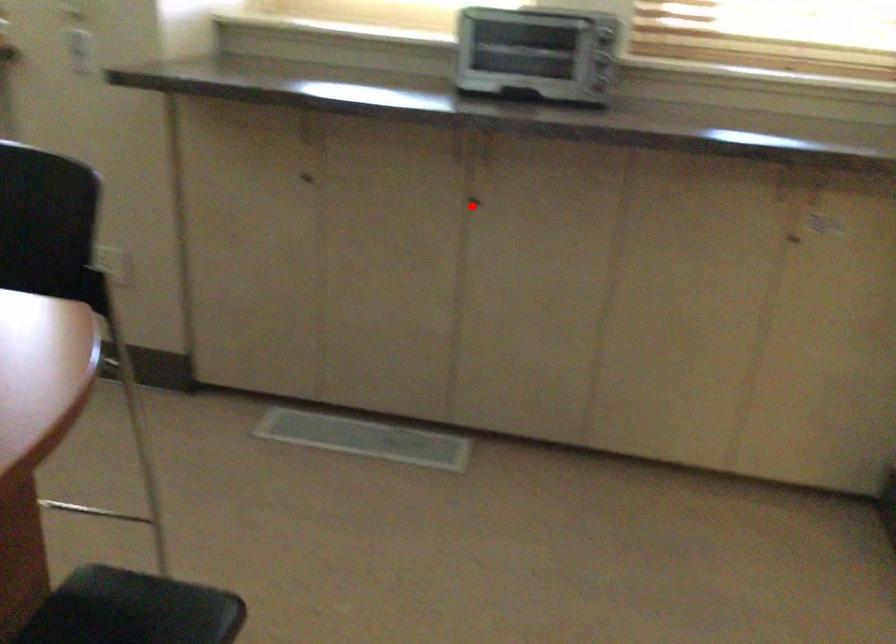
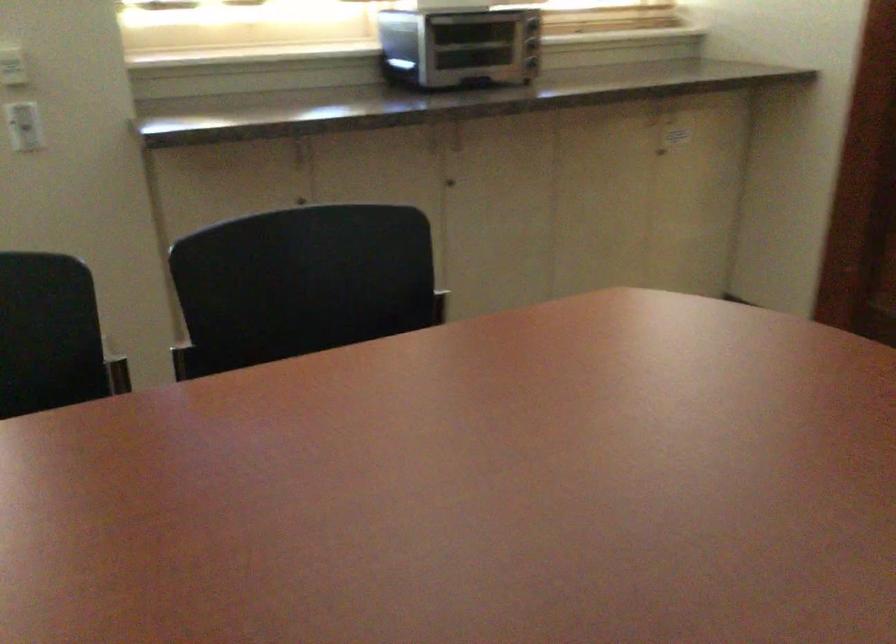
Question: I am providing you with two images of the same scene from different viewpoints. In image1, a red point is highlighted. Considering the same 3D point in image2, which of the following is correct?

Choices:
 (A) It is closer
 (B) It is farther

Answer: (B)